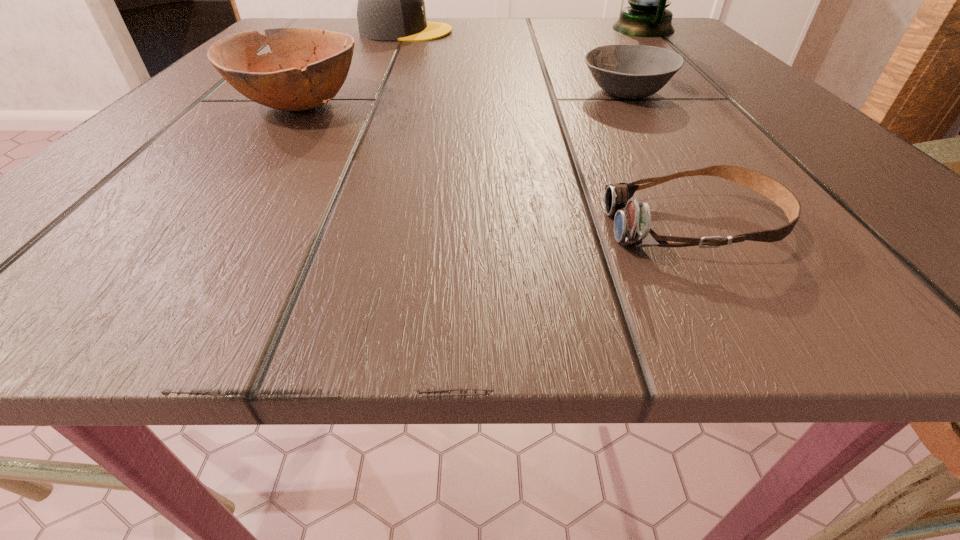
Locate an element on the screen. Image resolution: width=960 pixels, height=540 pixels. blank space located 0.280m on the back of the shorter bowl is located at coordinates (584, 26).

Locate an element on the screen. free spot located 0.390m on the front-facing side of the nearest object is located at coordinates (164, 227).

You are a GUI agent. You are given a task and a screenshot of the screen. Output one action in this format:
    pyautogui.click(x=<x>, y=<y>)
    Task: Click on the free space located on the front-facing side of the nearest object
    
    Given the screenshot: What is the action you would take?
    pyautogui.click(x=553, y=227)

Where is `blank space located 0.340m on the front-facing side of the nearest object`? This screenshot has width=960, height=540. blank space located 0.340m on the front-facing side of the nearest object is located at coordinates (222, 227).

At what (x,y) coordinates should I click in order to perform the action: click on lantern that is at the far edge. Please return your answer as a coordinate pair (x, y). The height and width of the screenshot is (540, 960). Looking at the image, I should click on (646, 16).

The image size is (960, 540). What are the coordinates of `cap that is at the far edge` in the screenshot? It's located at (391, 6).

The width and height of the screenshot is (960, 540). Identify the location of object at the near edge. (632, 221).

I want to click on cap located in the left edge section of the desktop, so click(x=391, y=6).

At what (x,y) coordinates should I click in order to perform the action: click on bowl that is at the left edge. Please return your answer as a coordinate pair (x, y). This screenshot has height=540, width=960. Looking at the image, I should click on (306, 68).

Locate an element on the screen. Image resolution: width=960 pixels, height=540 pixels. lantern that is at the right edge is located at coordinates (646, 16).